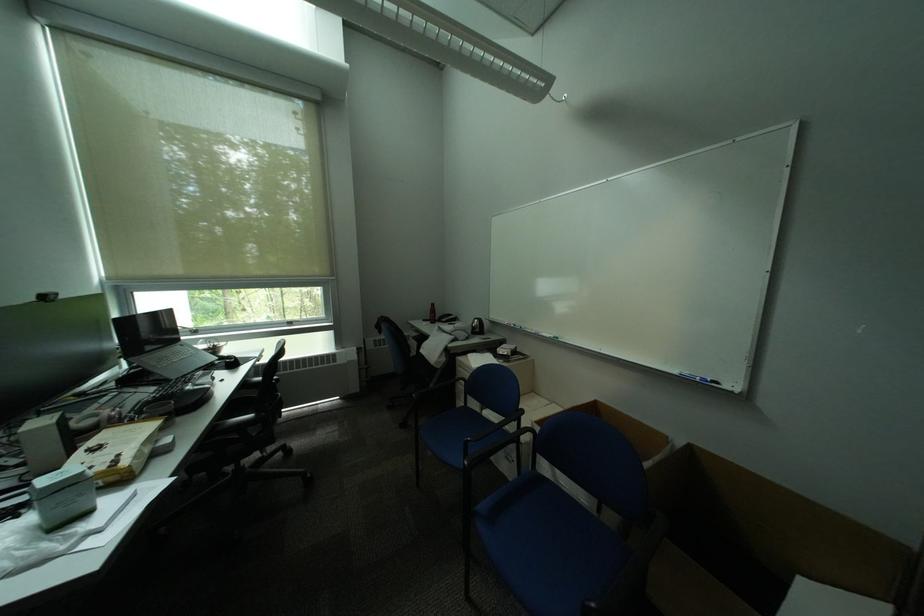
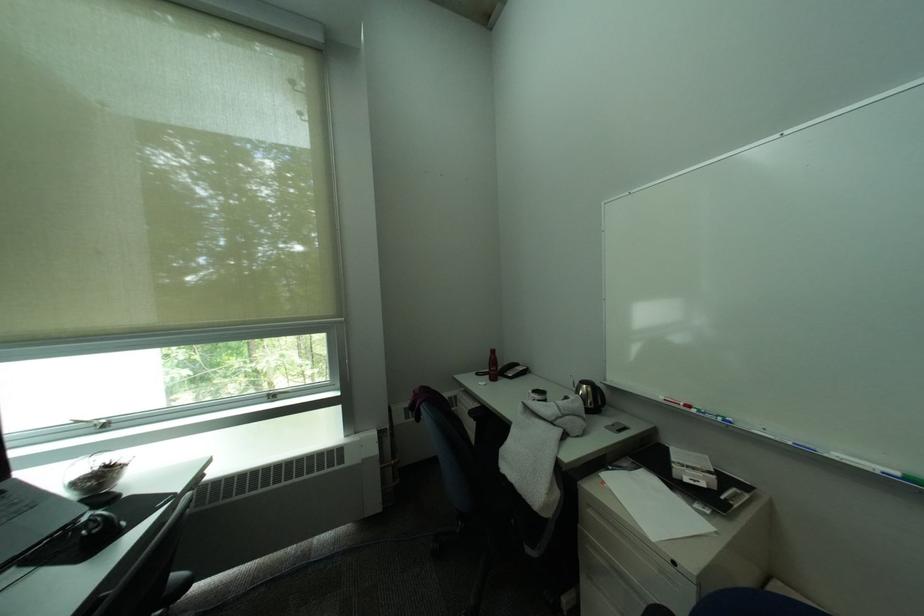
Locate, in the second image, the point that corresponds to (x=527, y=329) in the first image.

(719, 416)